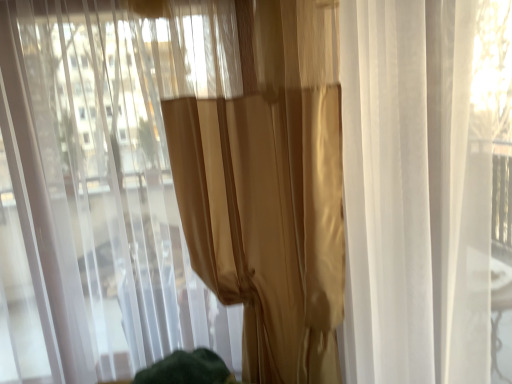
What is the approximate height of satin gold curtain at center, the first curtain in the left-to-right sequence?

satin gold curtain at center, the first curtain in the left-to-right sequence, is 1.95 meters in height.

The height and width of the screenshot is (384, 512). What do you see at coordinates (102, 187) in the screenshot?
I see `satin gold curtain at center, marked as the second curtain in a right-to-left arrangement` at bounding box center [102, 187].

Where is `satin gold curtain at center, marked as the second curtain in a right-to-left arrangement`? The width and height of the screenshot is (512, 384). satin gold curtain at center, marked as the second curtain in a right-to-left arrangement is located at coordinates (102, 187).

I want to click on satin gold curtain at center, which is the 1th curtain from right to left, so click(271, 190).

The image size is (512, 384). Describe the element at coordinates (271, 190) in the screenshot. I see `satin gold curtain at center, which is the 1th curtain from right to left` at that location.

I want to click on satin gold curtain at center, the first curtain in the left-to-right sequence, so click(x=102, y=187).

From the picture: Is satin gold curtain at center, acting as the second curtain starting from the left, at the left side of satin gold curtain at center, the first curtain in the left-to-right sequence?

No, satin gold curtain at center, acting as the second curtain starting from the left, is not to the left of satin gold curtain at center, the first curtain in the left-to-right sequence.

Is satin gold curtain at center, which is the 1th curtain from right to left, further to camera compared to satin gold curtain at center, the first curtain in the left-to-right sequence?

Yes.

Does point (334, 130) come closer to viewer compared to point (7, 242)?

Yes, point (334, 130) is closer to viewer.

From the image's perspective, which is above, satin gold curtain at center, which is the 1th curtain from right to left, or satin gold curtain at center, the first curtain in the left-to-right sequence?

satin gold curtain at center, which is the 1th curtain from right to left, from the image's perspective.

From a real-world perspective, does satin gold curtain at center, acting as the second curtain starting from the left, sit lower than satin gold curtain at center, marked as the second curtain in a right-to-left arrangement?

No, from a real-world perspective, satin gold curtain at center, acting as the second curtain starting from the left, is not beneath satin gold curtain at center, marked as the second curtain in a right-to-left arrangement.

Is satin gold curtain at center, acting as the second curtain starting from the left, thinner than satin gold curtain at center, marked as the second curtain in a right-to-left arrangement?

Yes, satin gold curtain at center, acting as the second curtain starting from the left, is thinner than satin gold curtain at center, marked as the second curtain in a right-to-left arrangement.

Does satin gold curtain at center, acting as the second curtain starting from the left, have a greater height compared to satin gold curtain at center, the first curtain in the left-to-right sequence?

In fact, satin gold curtain at center, acting as the second curtain starting from the left, may be shorter than satin gold curtain at center, the first curtain in the left-to-right sequence.

Can you confirm if satin gold curtain at center, which is the 1th curtain from right to left, is bigger than satin gold curtain at center, marked as the second curtain in a right-to-left arrangement?

Incorrect, satin gold curtain at center, which is the 1th curtain from right to left, is not larger than satin gold curtain at center, marked as the second curtain in a right-to-left arrangement.

Looking at this image, is satin gold curtain at center, acting as the second curtain starting from the left, positioned beyond the bounds of satin gold curtain at center, marked as the second curtain in a right-to-left arrangement?

Actually, satin gold curtain at center, acting as the second curtain starting from the left, is at least partially inside satin gold curtain at center, marked as the second curtain in a right-to-left arrangement.

Is satin gold curtain at center, acting as the second curtain starting from the left, next to satin gold curtain at center, marked as the second curtain in a right-to-left arrangement, and touching it?

satin gold curtain at center, acting as the second curtain starting from the left, and satin gold curtain at center, marked as the second curtain in a right-to-left arrangement, are clearly separated.

Does satin gold curtain at center, which is the 1th curtain from right to left, turn towards satin gold curtain at center, the first curtain in the left-to-right sequence?

Yes, satin gold curtain at center, which is the 1th curtain from right to left, is turned towards satin gold curtain at center, the first curtain in the left-to-right sequence.

Where is `curtain above the satin gold curtain at center, the first curtain in the left-to-right sequence (from a real-world perspective)`? This screenshot has height=384, width=512. curtain above the satin gold curtain at center, the first curtain in the left-to-right sequence (from a real-world perspective) is located at coordinates (271, 190).

Considering the relative positions of satin gold curtain at center, marked as the second curtain in a right-to-left arrangement, and satin gold curtain at center, acting as the second curtain starting from the left, in the image provided, is satin gold curtain at center, marked as the second curtain in a right-to-left arrangement, to the right of satin gold curtain at center, acting as the second curtain starting from the left, from the viewer's perspective?

Incorrect, satin gold curtain at center, marked as the second curtain in a right-to-left arrangement, is not on the right side of satin gold curtain at center, acting as the second curtain starting from the left.

Between satin gold curtain at center, marked as the second curtain in a right-to-left arrangement, and satin gold curtain at center, acting as the second curtain starting from the left, which one is positioned behind?

satin gold curtain at center, acting as the second curtain starting from the left, is further away from the camera.

Is point (165, 155) closer to camera compared to point (219, 224)?

Yes, point (165, 155) is in front of point (219, 224).

From the image's perspective, is satin gold curtain at center, the first curtain in the left-to-right sequence, above or below satin gold curtain at center, which is the 1th curtain from right to left?

From the image's perspective, satin gold curtain at center, the first curtain in the left-to-right sequence, appears below satin gold curtain at center, which is the 1th curtain from right to left.

From a real-world perspective, is satin gold curtain at center, the first curtain in the left-to-right sequence, physically located above or below satin gold curtain at center, which is the 1th curtain from right to left?

satin gold curtain at center, the first curtain in the left-to-right sequence, is situated lower than satin gold curtain at center, which is the 1th curtain from right to left, in the real world.

Is satin gold curtain at center, the first curtain in the left-to-right sequence, wider than satin gold curtain at center, which is the 1th curtain from right to left?

Yes.

Considering the relative sizes of satin gold curtain at center, marked as the second curtain in a right-to-left arrangement, and satin gold curtain at center, acting as the second curtain starting from the left, in the image provided, is satin gold curtain at center, marked as the second curtain in a right-to-left arrangement, taller than satin gold curtain at center, acting as the second curtain starting from the left,?

Indeed, satin gold curtain at center, marked as the second curtain in a right-to-left arrangement, has a greater height compared to satin gold curtain at center, acting as the second curtain starting from the left.

Is satin gold curtain at center, marked as the second curtain in a right-to-left arrangement, bigger or smaller than satin gold curtain at center, which is the 1th curtain from right to left?

satin gold curtain at center, marked as the second curtain in a right-to-left arrangement, is bigger than satin gold curtain at center, which is the 1th curtain from right to left.

Is satin gold curtain at center, marked as the second curtain in a right-to-left arrangement, inside the boundaries of satin gold curtain at center, acting as the second curtain starting from the left, or outside?

satin gold curtain at center, marked as the second curtain in a right-to-left arrangement, is outside satin gold curtain at center, acting as the second curtain starting from the left.

Can you see satin gold curtain at center, marked as the second curtain in a right-to-left arrangement, touching satin gold curtain at center, which is the 1th curtain from right to left?

No.

Is satin gold curtain at center, marked as the second curtain in a right-to-left arrangement, looking in the opposite direction of satin gold curtain at center, which is the 1th curtain from right to left?

Yes, satin gold curtain at center, marked as the second curtain in a right-to-left arrangement,'s orientation is away from satin gold curtain at center, which is the 1th curtain from right to left.

How many degrees apart are the facing directions of satin gold curtain at center, marked as the second curtain in a right-to-left arrangement, and satin gold curtain at center, which is the 1th curtain from right to left?

satin gold curtain at center, marked as the second curtain in a right-to-left arrangement, and satin gold curtain at center, which is the 1th curtain from right to left, are facing 0.000111 degrees away from each other.

This screenshot has height=384, width=512. Identify the location of curtain above the satin gold curtain at center, marked as the second curtain in a right-to-left arrangement (from the image's perspective). (271, 190).

Locate an element on the screen. This screenshot has height=384, width=512. curtain behind the satin gold curtain at center, marked as the second curtain in a right-to-left arrangement is located at coordinates (271, 190).

You are a GUI agent. You are given a task and a screenshot of the screen. Output one action in this format:
    pyautogui.click(x=<x>, y=<y>)
    Task: Click on the curtain above the satin gold curtain at center, marked as the second curtain in a right-to-left arrangement (from the image's perspective)
    The height and width of the screenshot is (384, 512).
    Given the screenshot: What is the action you would take?
    pyautogui.click(x=271, y=190)